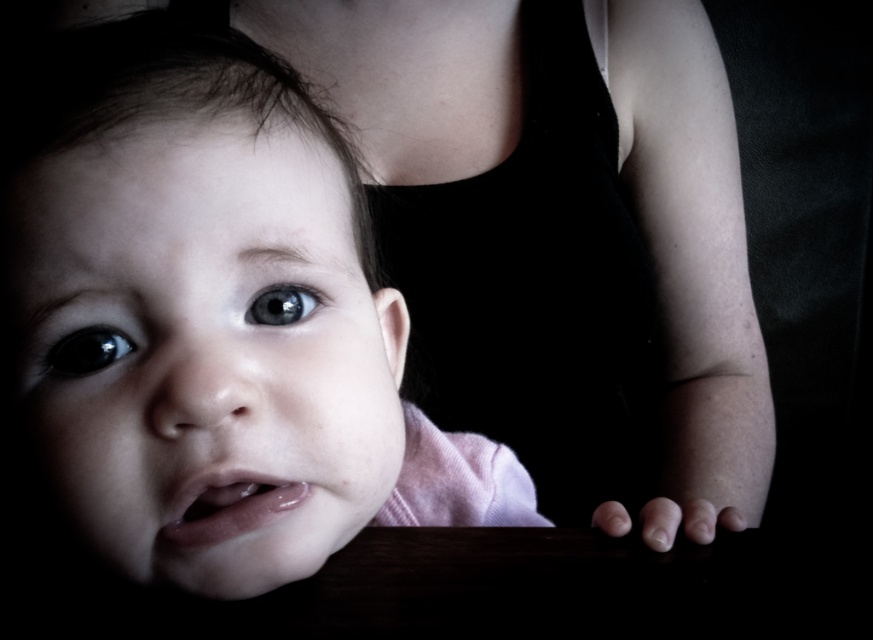
Does smooth skin baby at center have a greater width compared to glossy black eye at center?

Yes.

Who is more distant from viewer, [590,296] or [86,352]?

The point [590,296] is behind.

Find the location of `smooth skin baby at center`. smooth skin baby at center is located at coordinates (692, 268).

Does pink fabric at center appear over blue glossy eye at center?

Actually, pink fabric at center is below blue glossy eye at center.

The height and width of the screenshot is (640, 873). What are the coordinates of `pink fabric at center` in the screenshot? It's located at (212, 317).

Can you confirm if pink fabric at center is shorter than glossy black eye at center?

In fact, pink fabric at center may be taller than glossy black eye at center.

Based on the photo, can you confirm if pink fabric at center is bigger than glossy black eye at center?

Yes, pink fabric at center is bigger than glossy black eye at center.

Which is in front, point (304, 198) or point (112, 353)?

Point (112, 353) is in front.

Identify the location of pink fabric at center. (212, 317).